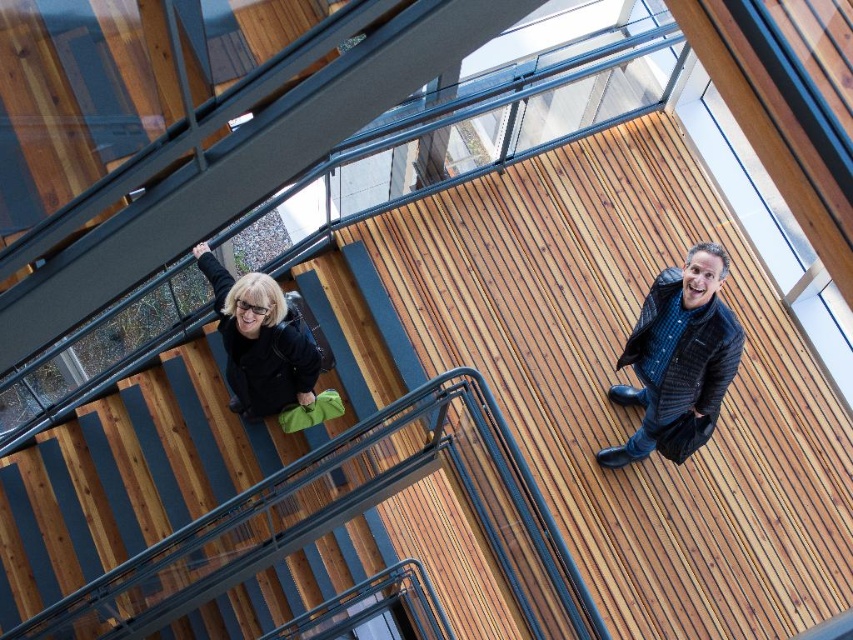
Question: Does dark blue textured jacket at upper right appear under matte black jacket at center?

Choices:
 (A) yes
 (B) no

Answer: (A)

Question: Is dark blue textured jacket at upper right positioned in front of matte black jacket at center?

Choices:
 (A) yes
 (B) no

Answer: (A)

Question: Does dark blue textured jacket at upper right appear over matte black jacket at center?

Choices:
 (A) no
 (B) yes

Answer: (A)

Question: Which object appears farthest from the camera in this image?

Choices:
 (A) matte black jacket at center
 (B) dark blue textured jacket at upper right

Answer: (A)